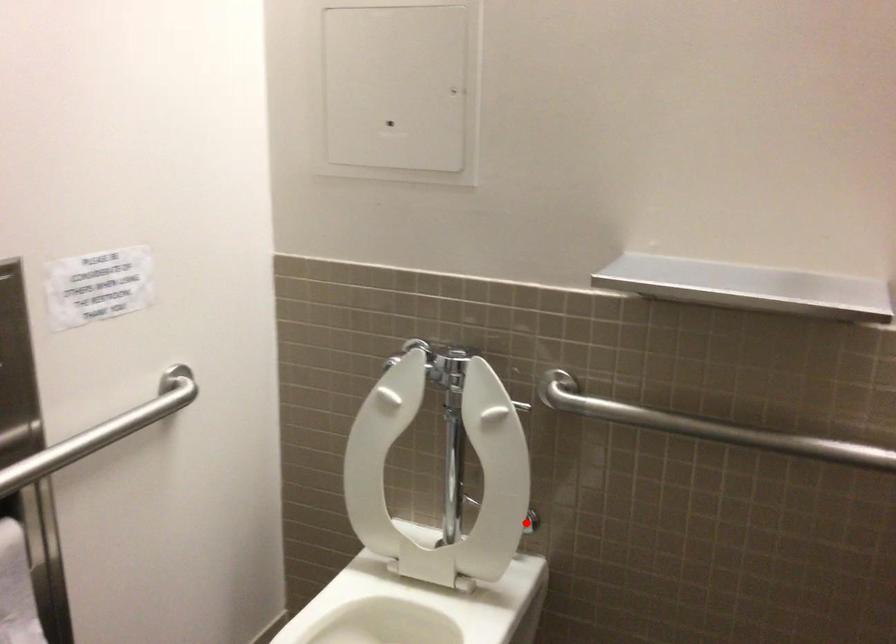
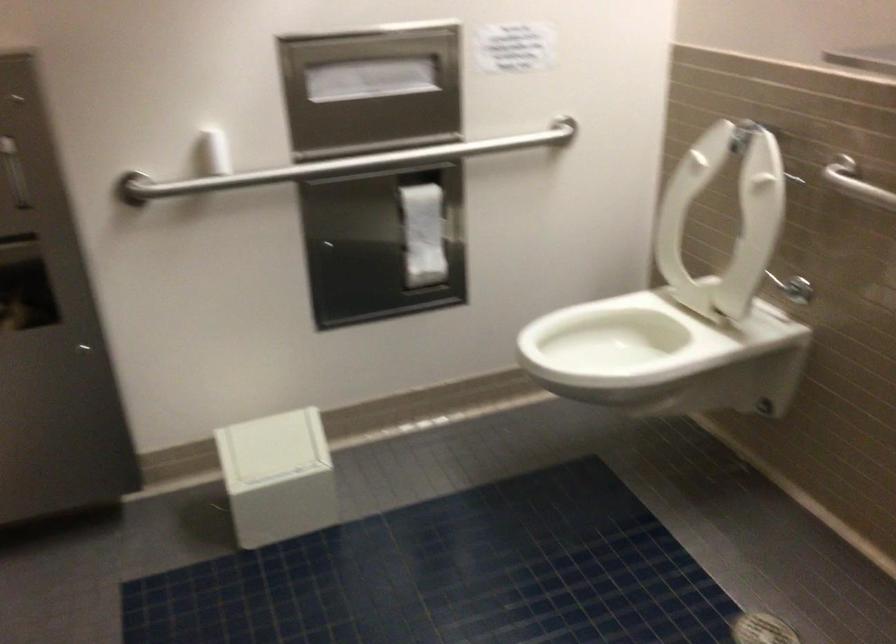
The point at the highlighted location is marked in the first image. Where is the corresponding point in the second image?

(793, 288)